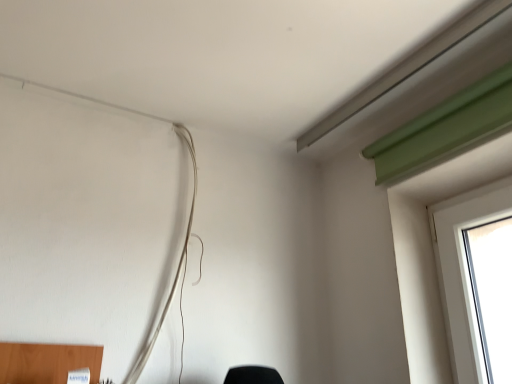
Question: Relative to black matte lampshade at lower center, is white matte wire at upper left in front or behind?

Choices:
 (A) behind
 (B) front

Answer: (A)

Question: Visually, is white matte wire at upper left positioned to the left or to the right of black matte lampshade at lower center?

Choices:
 (A) right
 (B) left

Answer: (B)

Question: Would you say white matte wire at upper left is inside or outside black matte lampshade at lower center?

Choices:
 (A) inside
 (B) outside

Answer: (B)

Question: From the image's perspective, is black matte lampshade at lower center located above or below white matte wire at upper left?

Choices:
 (A) above
 (B) below

Answer: (B)

Question: In terms of height, does black matte lampshade at lower center look taller or shorter compared to white matte wire at upper left?

Choices:
 (A) tall
 (B) short

Answer: (B)

Question: Is black matte lampshade at lower center wider or thinner than white matte wire at upper left?

Choices:
 (A) wide
 (B) thin

Answer: (A)

Question: Would you say black matte lampshade at lower center is inside or outside white matte wire at upper left?

Choices:
 (A) inside
 (B) outside

Answer: (B)